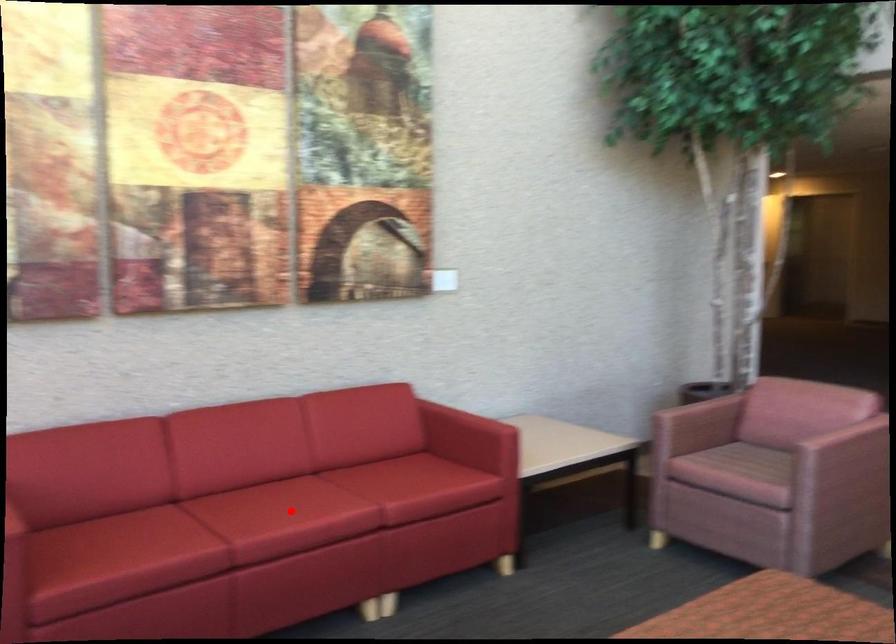
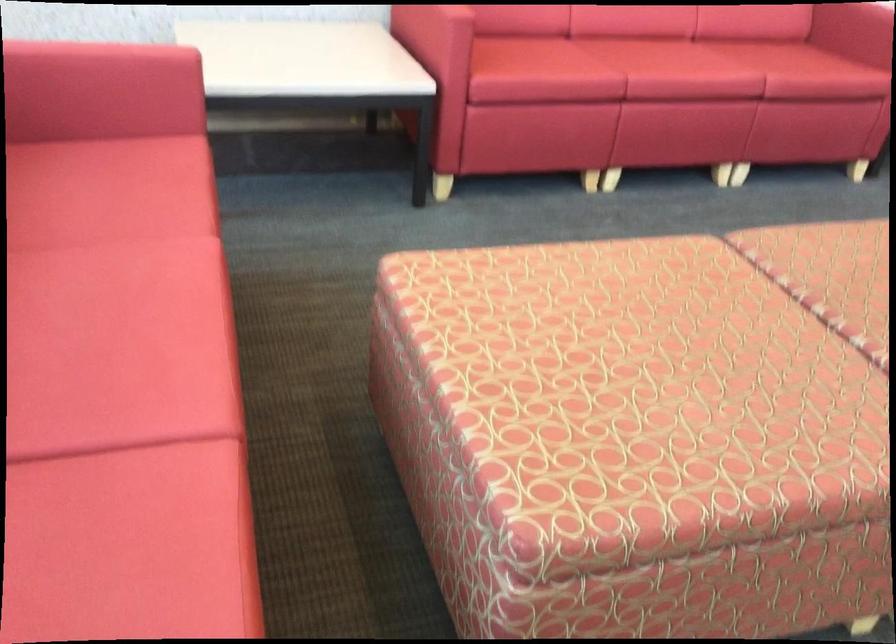
Find the pixel in the second image that matches the highlighted location in the first image.

(677, 62)